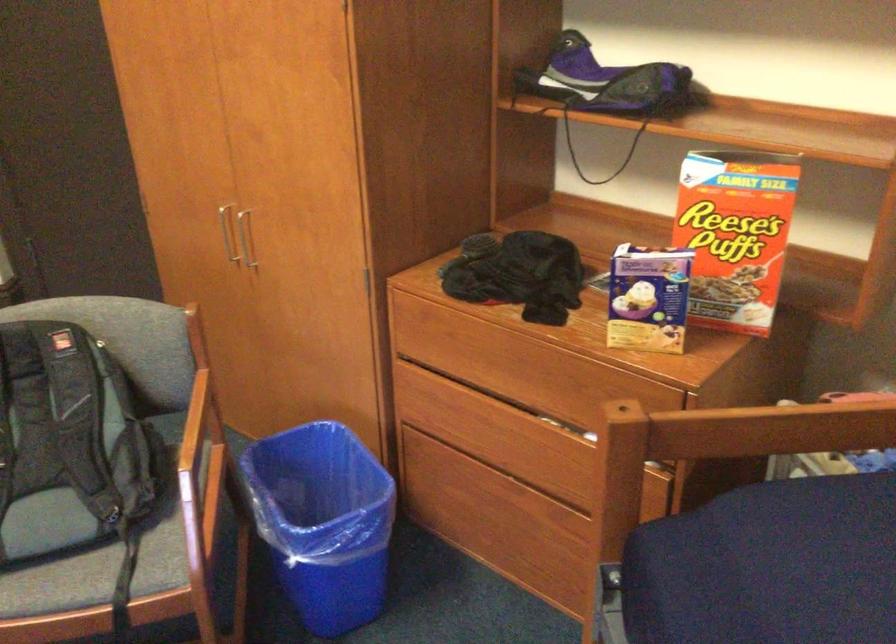
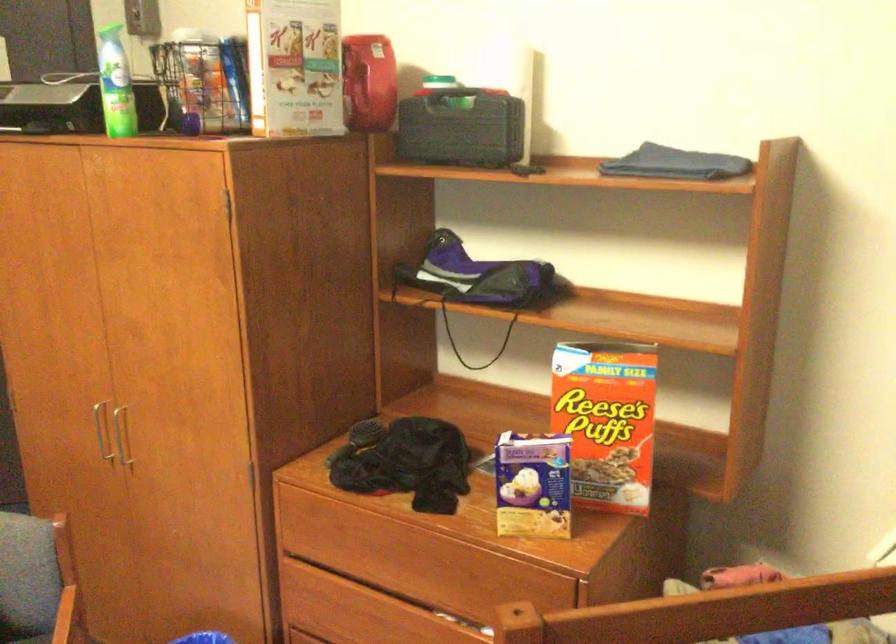
Question: I am providing you with two images of the same scene from different viewpoints. After the viewpoint changes to image2, which objects are now occluded?

Choices:
 (A) red plastic dispenser
 (B) spray can nozzle
 (C) drawer cutout handle
 (D) none of these

Answer: (D)